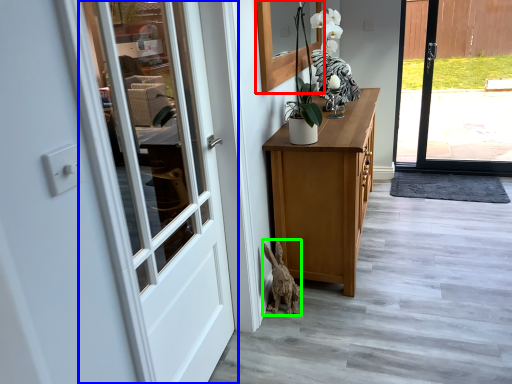
Question: Which object is positioned farthest from window (highlighted by a red box)? Select from door (highlighted by a blue box) and animal (highlighted by a green box).

Choices:
 (A) door
 (B) animal

Answer: (B)